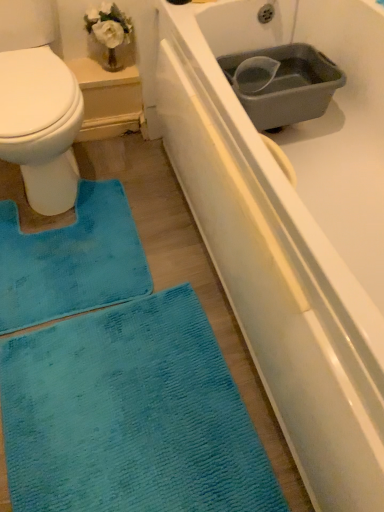
Question: From a real-world perspective, is white matte bathtub at center on teal soft rug at lower left?

Choices:
 (A) no
 (B) yes

Answer: (A)

Question: Could you tell me if white matte bathtub at center is facing teal soft rug at lower left?

Choices:
 (A) no
 (B) yes

Answer: (B)

Question: Is white matte bathtub at center at the left side of teal soft rug at lower left?

Choices:
 (A) no
 (B) yes

Answer: (A)

Question: Can you confirm if white matte bathtub at center is positioned to the right of teal soft rug at lower left?

Choices:
 (A) yes
 (B) no

Answer: (A)

Question: Is white matte bathtub at center oriented away from teal soft rug at lower left?

Choices:
 (A) no
 (B) yes

Answer: (A)

Question: Is white matte bathtub at center thinner than teal soft rug at lower left?

Choices:
 (A) yes
 (B) no

Answer: (B)

Question: Would you say teal soft rug at lower left contains blue textured mat at lower left?

Choices:
 (A) no
 (B) yes

Answer: (A)

Question: Does teal soft rug at lower left lie in front of blue textured mat at lower left?

Choices:
 (A) yes
 (B) no

Answer: (A)

Question: From the image's perspective, is teal soft rug at lower left above blue textured mat at lower left?

Choices:
 (A) no
 (B) yes

Answer: (A)

Question: Can you confirm if teal soft rug at lower left is shorter than blue textured mat at lower left?

Choices:
 (A) no
 (B) yes

Answer: (A)

Question: Does teal soft rug at lower left lie behind blue textured mat at lower left?

Choices:
 (A) no
 (B) yes

Answer: (A)

Question: Is teal soft rug at lower left located outside blue textured mat at lower left?

Choices:
 (A) yes
 (B) no

Answer: (A)

Question: Considering the relative sizes of gray plastic basin at upper right and blue textured mat at lower left in the image provided, is gray plastic basin at upper right bigger than blue textured mat at lower left?

Choices:
 (A) yes
 (B) no

Answer: (A)